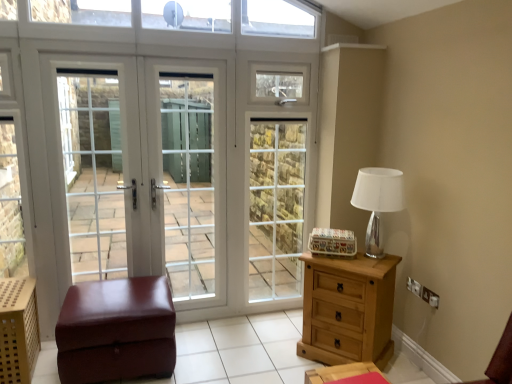
At what (x,y) coordinates should I click in order to perform the action: click on vacant space situated above white glass door at center, placed as the 1th screen door when sorted from right to left (from a real-world perspective). Please return your answer as a coordinate pair (x, y). This screenshot has height=384, width=512. Looking at the image, I should click on (281, 47).